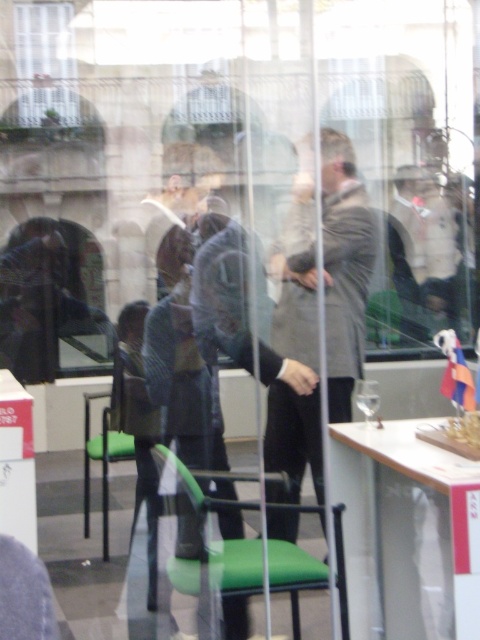
You are standing inside the building and see the point marked at coordinates (344, 268). What object is located at that point?

The gray wool coat at center is located at point 0.417, 0.717.

You are standing in a formal event space with a large window. You see two points marked on the glass surface. The first point is at coordinate (452, 220) and the second is at (292, 436). Which point is closer to you?

Point (292, 436) is closer to you because it is less further to the camera than point (452, 220).